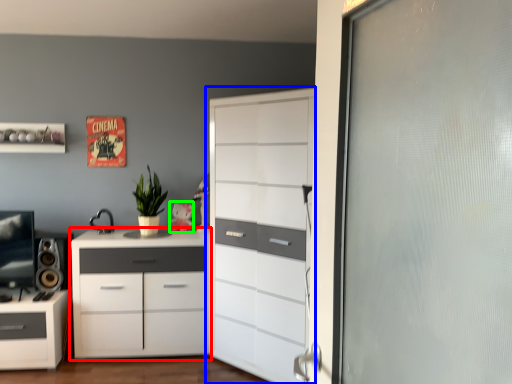
Question: Estimate the real-world distances between objects in this image. Which object is farther from chest of drawers (highlighted by a red box), chest of drawers (highlighted by a blue box) or toy (highlighted by a green box)?

Choices:
 (A) chest of drawers
 (B) toy

Answer: (B)